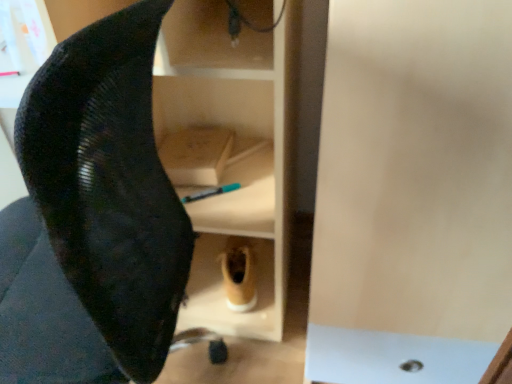
Question: From a real-world perspective, is tan suede boot at lower center physically located above or below black mesh swivel chair at left?

Choices:
 (A) above
 (B) below

Answer: (B)

Question: Looking at their shapes, would you say tan suede boot at lower center is wider or thinner than black mesh swivel chair at left?

Choices:
 (A) thin
 (B) wide

Answer: (A)

Question: Does point (225, 244) appear closer or farther from the camera than point (102, 51)?

Choices:
 (A) farther
 (B) closer

Answer: (A)

Question: Is black mesh swivel chair at left in front of or behind tan suede boot at lower center in the image?

Choices:
 (A) front
 (B) behind

Answer: (A)

Question: Is black mesh swivel chair at left inside or outside of tan suede boot at lower center?

Choices:
 (A) inside
 (B) outside

Answer: (B)

Question: In terms of height, does black mesh swivel chair at left look taller or shorter compared to tan suede boot at lower center?

Choices:
 (A) tall
 (B) short

Answer: (A)

Question: From the image's perspective, is black mesh swivel chair at left above or below tan suede boot at lower center?

Choices:
 (A) above
 (B) below

Answer: (A)